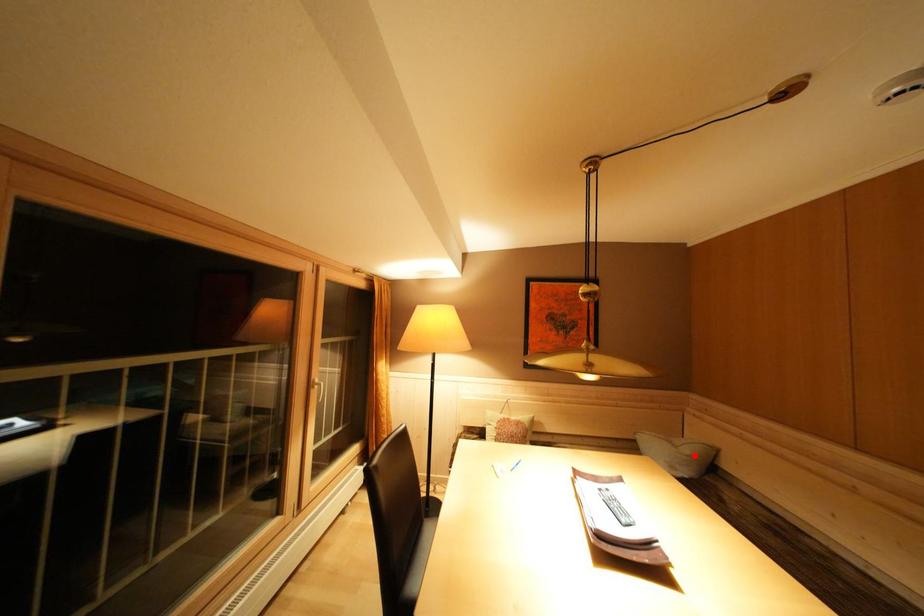
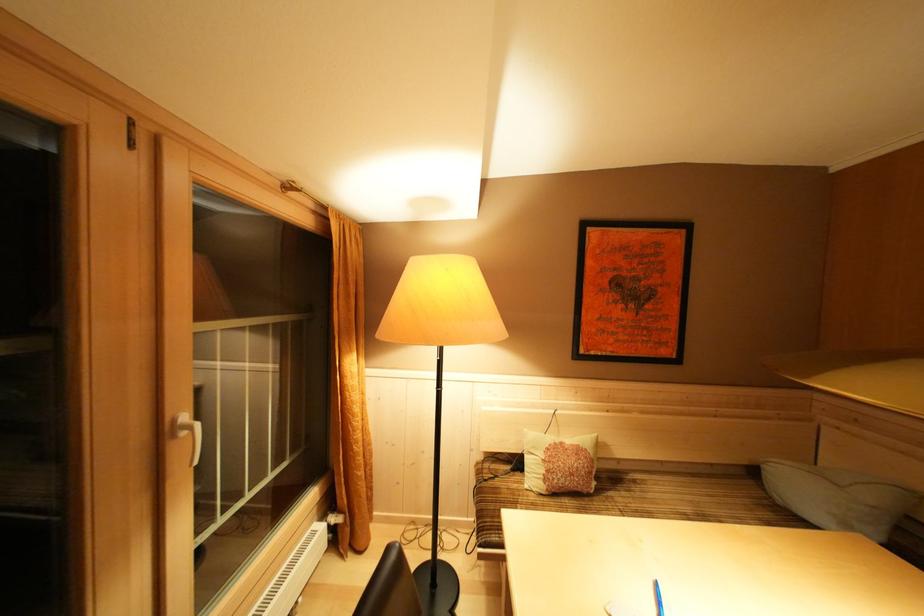
Question: I am providing you with two images of the same scene from different viewpoints. In image1, a red point is highlighted. Considering the same 3D point in image2, which of the following is correct?

Choices:
 (A) It is closer
 (B) It is farther

Answer: (A)